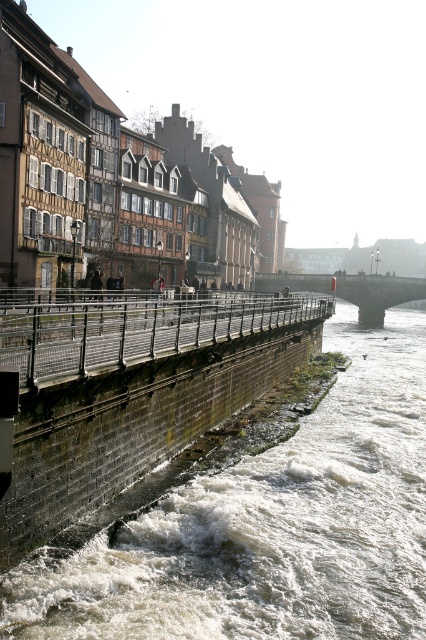
Question: Estimate the real-world distances between objects in this image. Which object is closer to the dark gray stone bridge at center?

Choices:
 (A) metal/rustic rail at left
 (B) rough concrete river at center

Answer: (B)

Question: Can you confirm if metal/rustic rail at left is positioned below dark gray stone bridge at center?

Choices:
 (A) no
 (B) yes

Answer: (B)

Question: Which point is farther from the camera taking this photo?

Choices:
 (A) (172, 324)
 (B) (281, 284)

Answer: (B)

Question: Can you confirm if rough concrete river at center is bigger than metal/rustic rail at left?

Choices:
 (A) no
 (B) yes

Answer: (A)

Question: Does rough concrete river at center appear on the left side of metal/rustic rail at left?

Choices:
 (A) yes
 (B) no

Answer: (B)

Question: Considering the real-world distances, which object is closest to the metal/rustic rail at left?

Choices:
 (A) rough concrete river at center
 (B) dark gray stone bridge at center

Answer: (A)